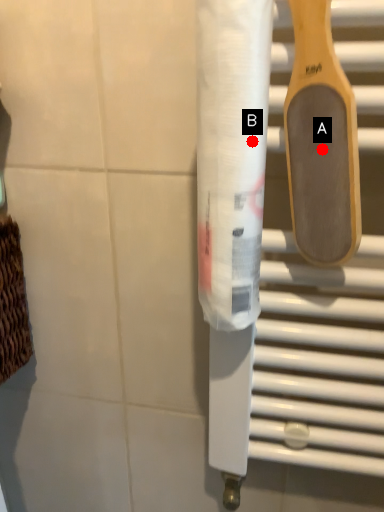
Question: Two points are circled on the image, labeled by A and B beside each circle. Among these points, which one is farthest from the camera?

Choices:
 (A) A is further
 (B) B is further

Answer: (A)